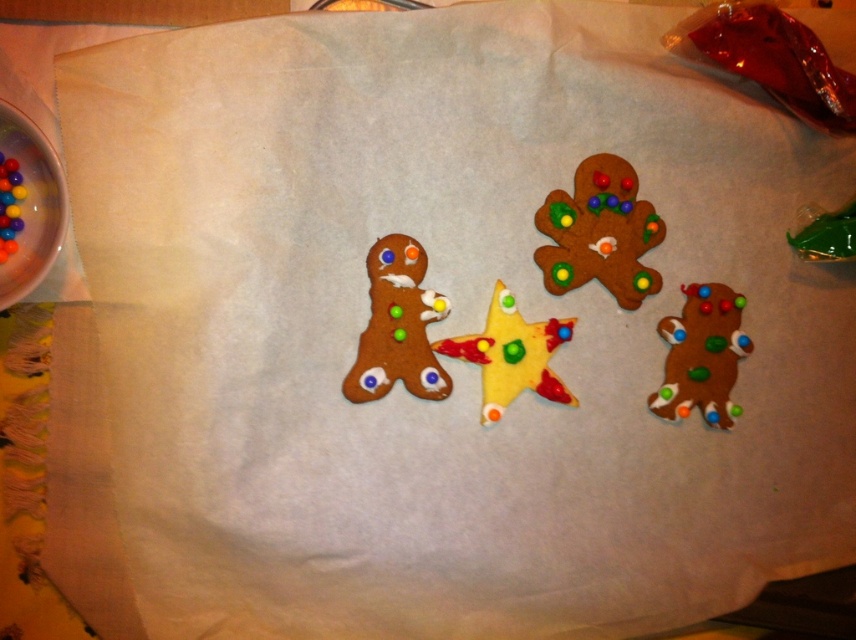
You are a baker arranging cookies on a baking sheet. You have a matte brown gingerbread man at upper right and glossy multicolored beads at left. Where should you place a new cookie to ensure it is between these two items?

The new cookie should be placed between the matte brown gingerbread man at upper right and the glossy multicolored beads at left, as the gingerbread man is positioned on the right side of the beads.

Based on the photo, you are a baker checking the baking sheet and see the matte brown gingerbread man at upper right and the matte brown gingerbread man at lower right. Which one do you think has a larger width?

The matte brown gingerbread man at upper right might be wider than the matte brown gingerbread man at lower right according to the description.